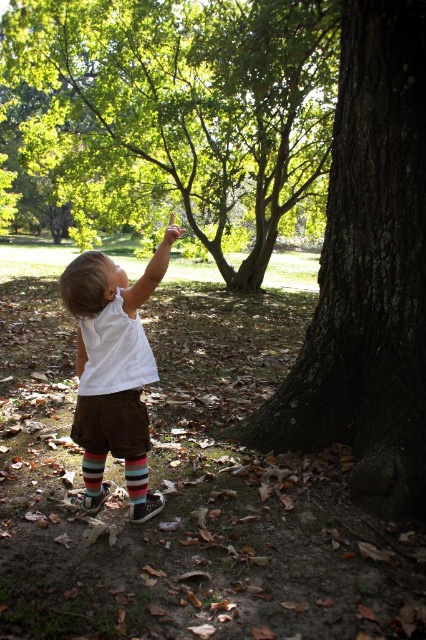
Is point (131, 476) behind point (86, 461)?

That is False.

Which is in front, point (138, 486) or point (98, 492)?

Point (138, 486) is in front.

Identify the location of striped cotton sock at lower center. The image size is (426, 640). (137, 477).

Looking at this image, which is above, smooth brown bark at center or striped cotton sock at lower center?

smooth brown bark at center

What do you see at coordinates (368, 273) in the screenshot? The image size is (426, 640). I see `smooth brown bark at center` at bounding box center [368, 273].

Locate an element on the screen. This screenshot has height=640, width=426. smooth brown bark at center is located at coordinates (368, 273).

Is point (377, 320) more distant than point (78, 433)?

Yes, point (377, 320) is behind point (78, 433).

Does smooth brown bark at center have a greater width compared to white cotton toddler at center?

Correct, the width of smooth brown bark at center exceeds that of white cotton toddler at center.

Measure the distance between point (350, 400) and camera.

The distance of point (350, 400) from camera is 4.11 meters.

Locate an element on the screen. smooth brown bark at center is located at coordinates (368, 273).